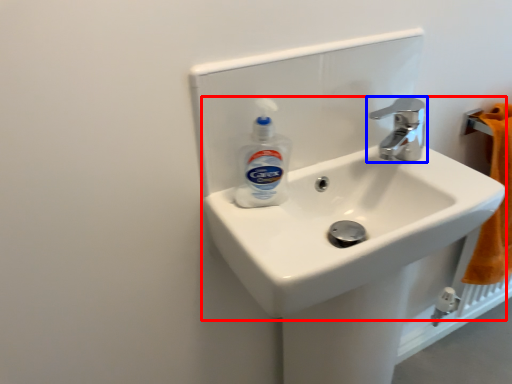
Question: Which object is closer to the camera taking this photo, sink (highlighted by a red box) or tap (highlighted by a blue box)?

Choices:
 (A) sink
 (B) tap

Answer: (A)